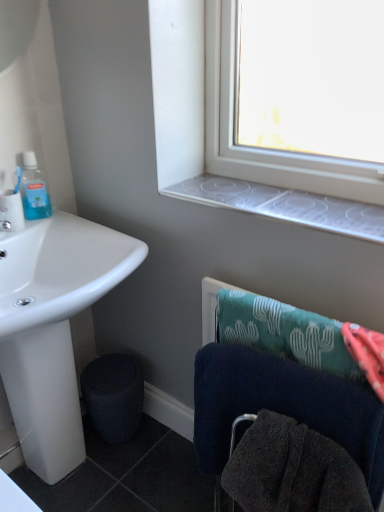
This screenshot has width=384, height=512. In order to click on free point above dark blue towel at lower right (from a real-world perspective) in this screenshot , I will do `click(304, 373)`.